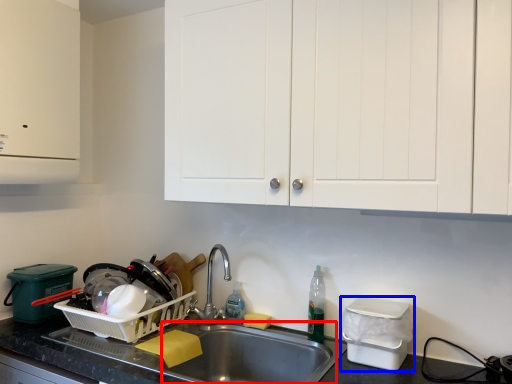
Question: Among these objects, which one is nearest to the camera, sink (highlighted by a red box) or appliance (highlighted by a blue box)?

Choices:
 (A) sink
 (B) appliance

Answer: (A)